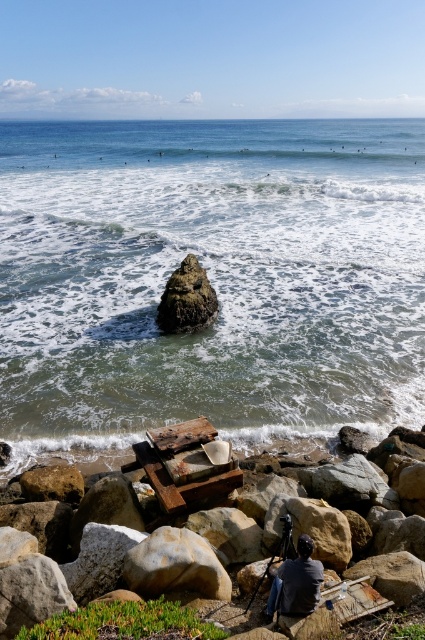
Who is taller, rusty wood picnic table at center or speckled beige rock at center?

With more height is rusty wood picnic table at center.

You are a GUI agent. You are given a task and a screenshot of the screen. Output one action in this format:
    pyautogui.click(x=<x>, y=<y>)
    Task: Click on the rusty wood picnic table at center
    The image size is (425, 640).
    Given the screenshot: What is the action you would take?
    pyautogui.click(x=184, y=465)

Does greenish water at center have a larger size compared to rusty metal rock at center?

Correct, greenish water at center is larger in size than rusty metal rock at center.

Does greenish water at center have a smaller size compared to rusty metal rock at center?

No, greenish water at center is not smaller than rusty metal rock at center.

Find the location of a particular element. This screenshot has height=640, width=425. greenish water at center is located at coordinates (209, 278).

Locate an element on the screen. The image size is (425, 640). greenish water at center is located at coordinates (209, 278).

Which is behind, point (64, 358) or point (297, 595)?

The point (64, 358) is more distant.

How much distance is there between greenish water at center and dark gray fabric at center?

greenish water at center and dark gray fabric at center are 31.15 meters apart from each other.

The width and height of the screenshot is (425, 640). What do you see at coordinates (209, 278) in the screenshot?
I see `greenish water at center` at bounding box center [209, 278].

This screenshot has width=425, height=640. I want to click on greenish water at center, so click(209, 278).